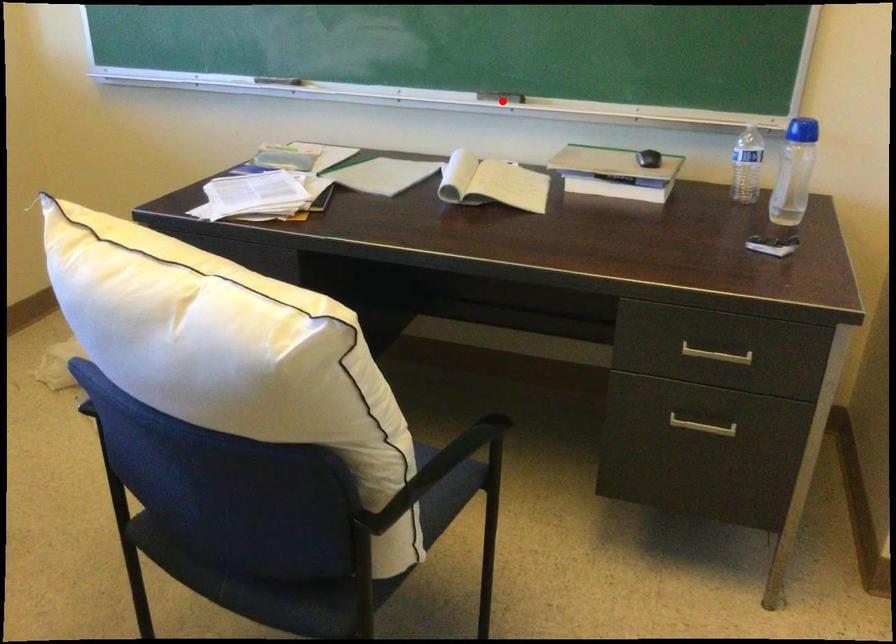
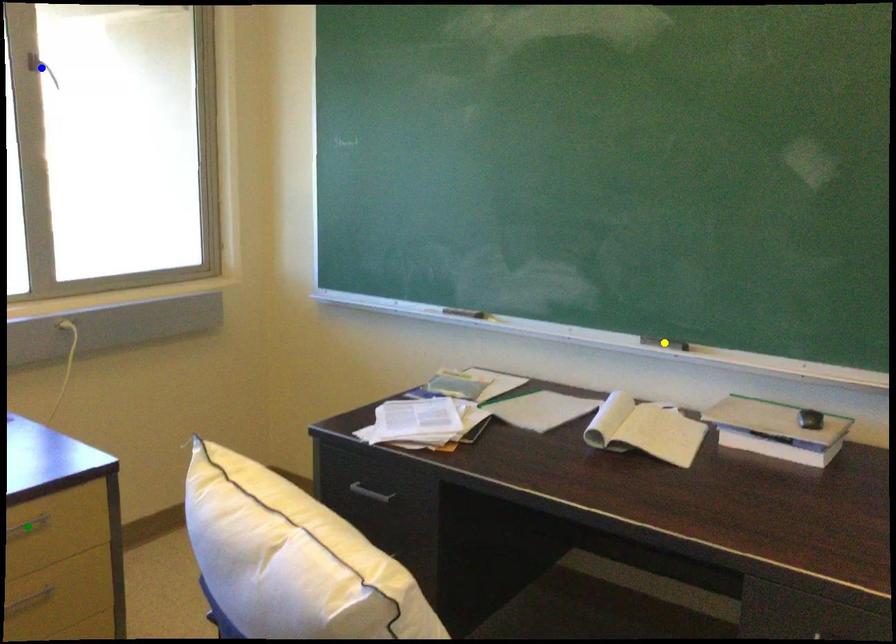
Question: I am providing you with two images of the same scene from different viewpoints. A red point is marked on the first image. You are given multiple points on the second image. In image 2, which mark is for the same physical point as the one in image 1?

Choices:
 (A) blue point
 (B) yellow point
 (C) green point

Answer: (B)